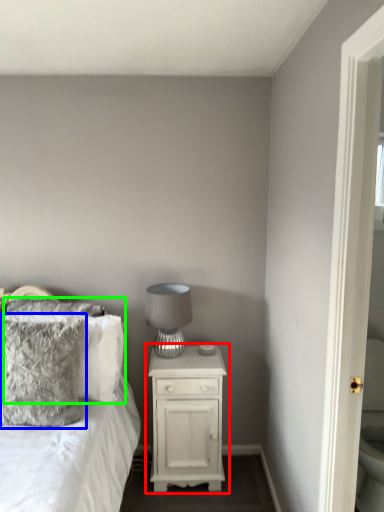
Question: Estimate the real-world distances between objects in this image. Which object is farther from nightstand (highlighted by a red box), pillow (highlighted by a blue box) or pillow (highlighted by a green box)?

Choices:
 (A) pillow
 (B) pillow

Answer: (A)